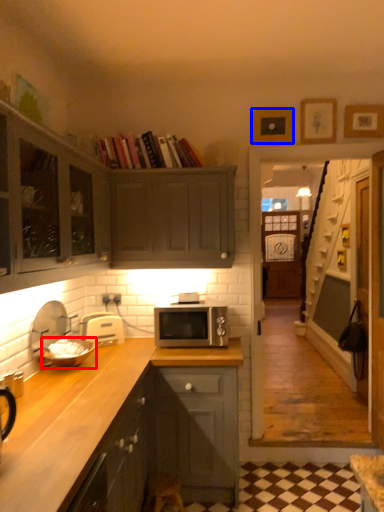
Question: Which object is closer to the camera taking this photo, appliance (highlighted by a red box) or picture frame (highlighted by a blue box)?

Choices:
 (A) appliance
 (B) picture frame

Answer: (A)